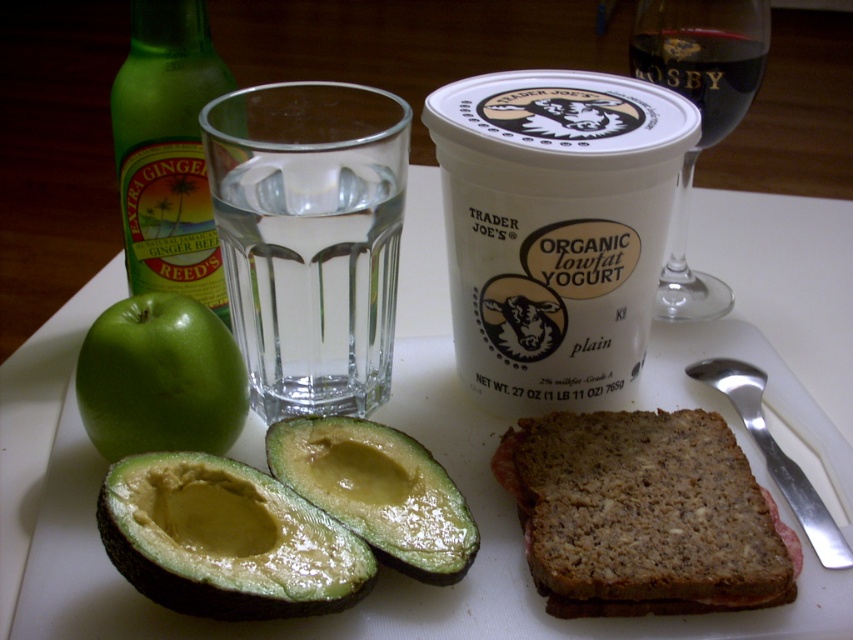
Question: Among these points, which one is farthest from the camera?

Choices:
 (A) (686, 419)
 (B) (743, 113)

Answer: (B)

Question: Which of the following is the farthest from the observer?

Choices:
 (A) brown grainy bread at lower center
 (B) white paper yogurt at upper center
 (C) clear glass water at center

Answer: (B)

Question: Where is green glass bottle at upper left located in relation to green matte apple at left in the image?

Choices:
 (A) left
 (B) right

Answer: (A)

Question: Which object is positioned closest to the brown grainy bread at lower center?

Choices:
 (A) transparent glass wine at upper right
 (B) white paper yogurt at upper center
 (C) clear glass water at center

Answer: (B)

Question: Can you confirm if green glass bottle at upper left is wider than dark red glass at upper right?

Choices:
 (A) yes
 (B) no

Answer: (B)

Question: Can you confirm if clear glass water at center is thinner than dark red glass at upper right?

Choices:
 (A) no
 (B) yes

Answer: (A)